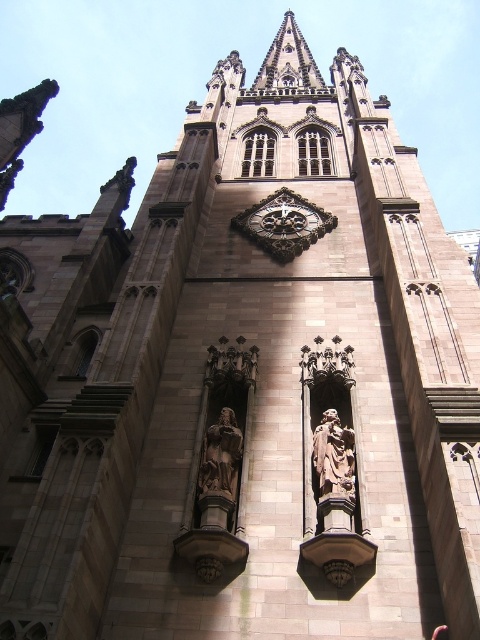
Question: From the image, what is the correct spatial relationship of polished bronze statue at center in relation to brown stone statue at center?

Choices:
 (A) above
 (B) below

Answer: (B)

Question: Which is nearer to the polished bronze statue at center?

Choices:
 (A) gold ornate clock at center
 (B) brown stone statue at center

Answer: (B)

Question: Can you confirm if polished bronze statue at center is positioned to the left of brown stone statue at center?

Choices:
 (A) no
 (B) yes

Answer: (B)

Question: Which point is closer to the camera?

Choices:
 (A) polished bronze statue at center
 (B) brown stone statue at center

Answer: (B)

Question: Does gold ornate clock at center appear over brown stone statue at center?

Choices:
 (A) no
 (B) yes

Answer: (B)

Question: Which point is farther from the camera taking this photo?

Choices:
 (A) (348, 435)
 (B) (211, 490)
 (C) (297, 237)

Answer: (C)